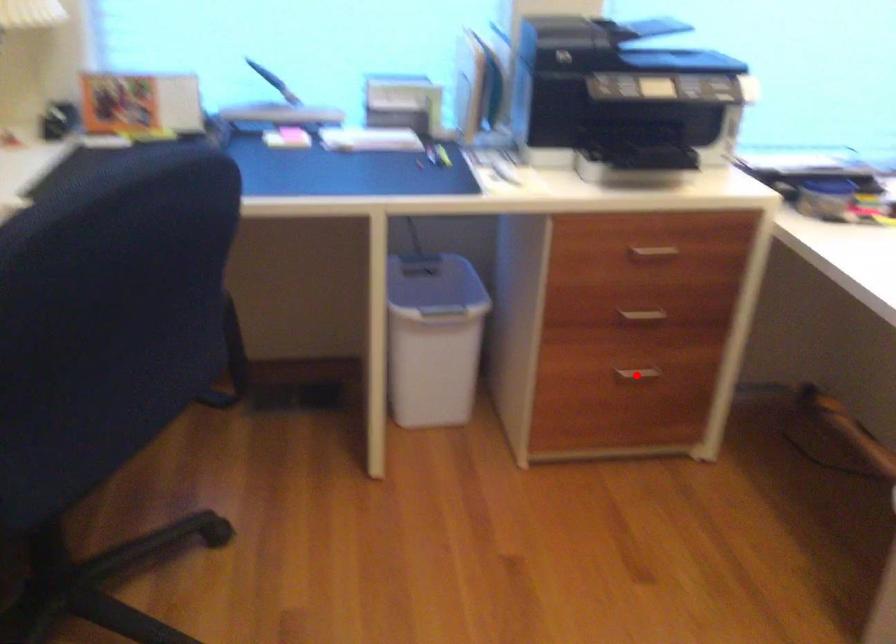
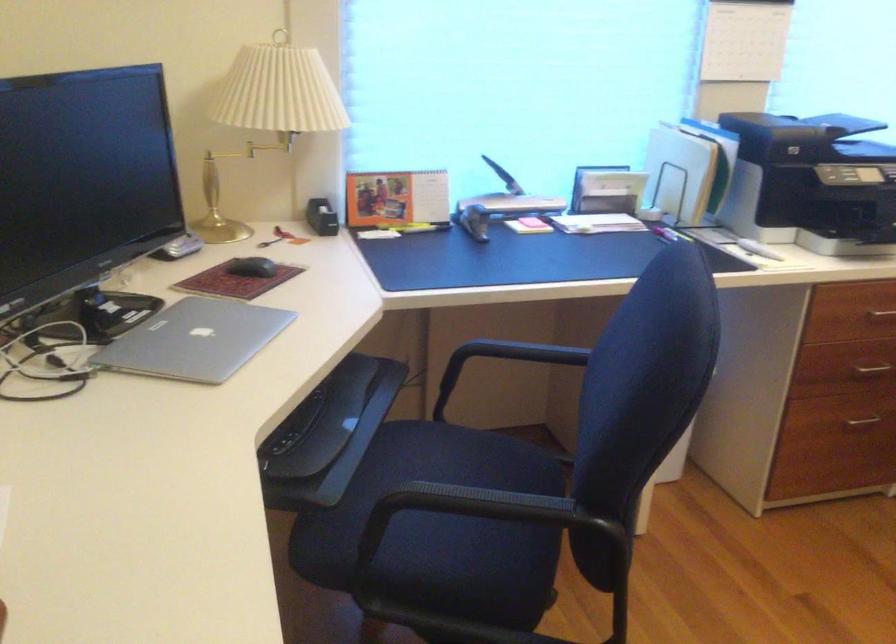
In the second image, find the point that corresponds to the highlighted location in the first image.

(860, 422)